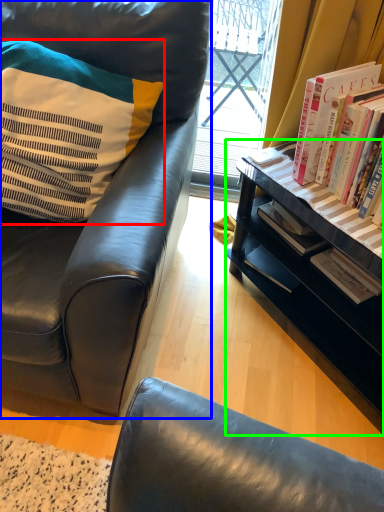
Question: Estimate the real-world distances between objects in this image. Which object is farther from pillow (highlighted by a red box), chair (highlighted by a blue box) or desk (highlighted by a green box)?

Choices:
 (A) chair
 (B) desk

Answer: (B)